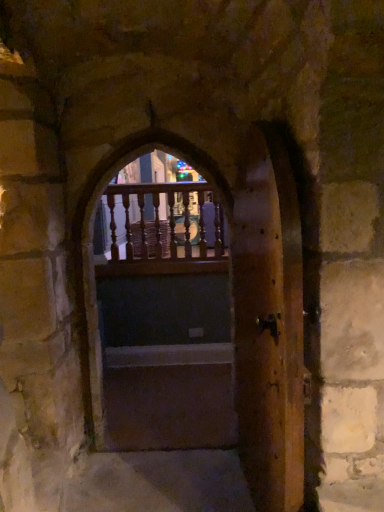
The width and height of the screenshot is (384, 512). Find the location of `free spot above wooden balusters at center (from a real-world perspective)`. free spot above wooden balusters at center (from a real-world perspective) is located at coordinates (152, 178).